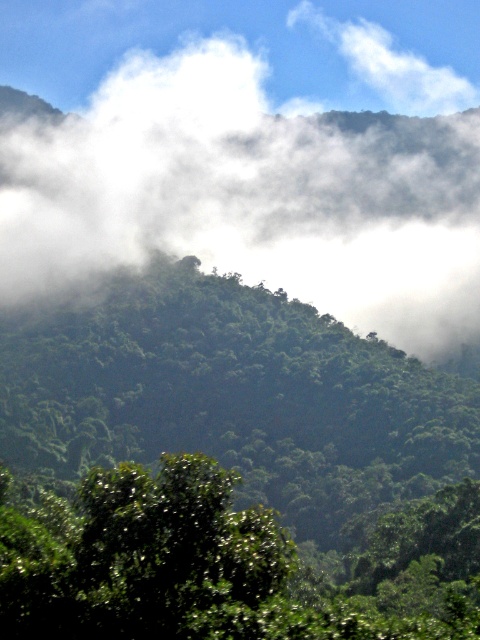
Question: Which of the following is the farthest from the observer?

Choices:
 (A) white fluffy fog at upper center
 (B) green leafy tree at center

Answer: (A)

Question: Does green leafy tree at center appear on the left side of white fluffy fog at upper center?

Choices:
 (A) yes
 (B) no

Answer: (B)

Question: Which of the following is the closest to the observer?

Choices:
 (A) white fluffy fog at upper center
 (B) green leafy tree at center

Answer: (B)

Question: Is the position of green leafy tree at center more distant than that of white fluffy fog at upper center?

Choices:
 (A) no
 (B) yes

Answer: (A)

Question: Does green leafy tree at center have a lesser width compared to white fluffy fog at upper center?

Choices:
 (A) no
 (B) yes

Answer: (B)